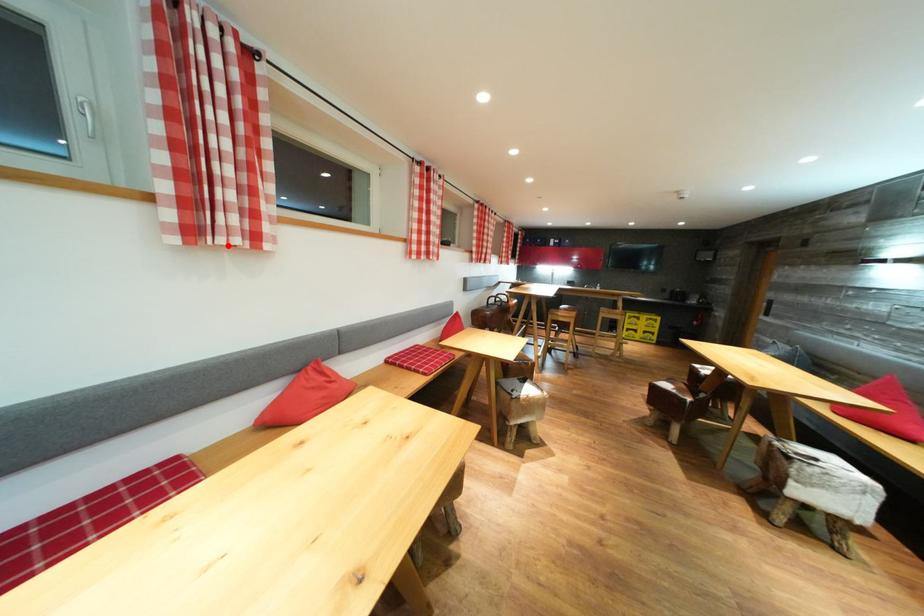
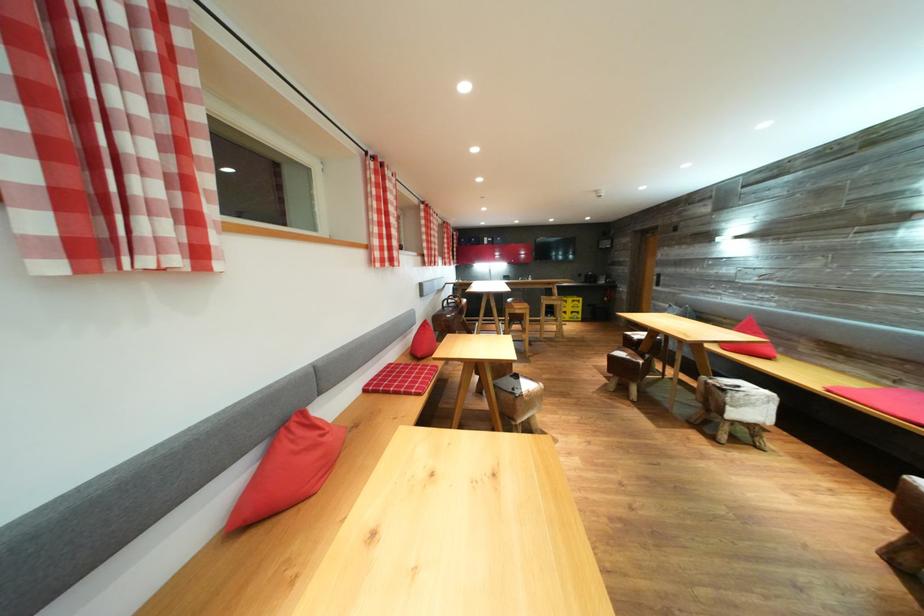
Where in the second image is the point corresponding to the highlighted location from the first image?

(153, 267)